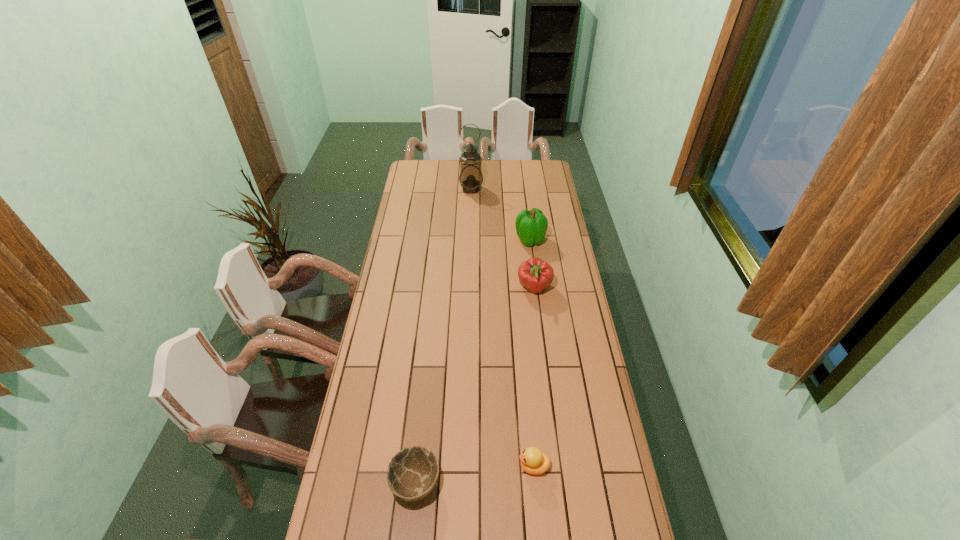
Identify which object is located as the fourth nearest to the duckling. Please provide its 2D coordinates. Your answer should be formatted as a tuple, i.e. [(x, y)], where the tuple contains the x and y coordinates of a point satisfying the conditions above.

[(470, 178)]

The image size is (960, 540). What are the coordinates of `vacant space that satisfies the following two spatial constraints: 1. on the face of the duckling; 2. on the front side of the leftmost object` in the screenshot? It's located at (535, 483).

You are a GUI agent. You are given a task and a screenshot of the screen. Output one action in this format:
    pyautogui.click(x=<x>, y=<y>)
    Task: Click on the free space that satisfies the following two spatial constraints: 1. on the back side of the taller bell pepper; 2. on the right side of the leftmost object
    The height and width of the screenshot is (540, 960).
    Given the screenshot: What is the action you would take?
    pyautogui.click(x=441, y=240)

This screenshot has height=540, width=960. Find the location of `vacant position in the image that satisfies the following two spatial constraints: 1. on the back side of the fourth shortest object; 2. on the right side of the leftmost object`. vacant position in the image that satisfies the following two spatial constraints: 1. on the back side of the fourth shortest object; 2. on the right side of the leftmost object is located at coordinates (441, 240).